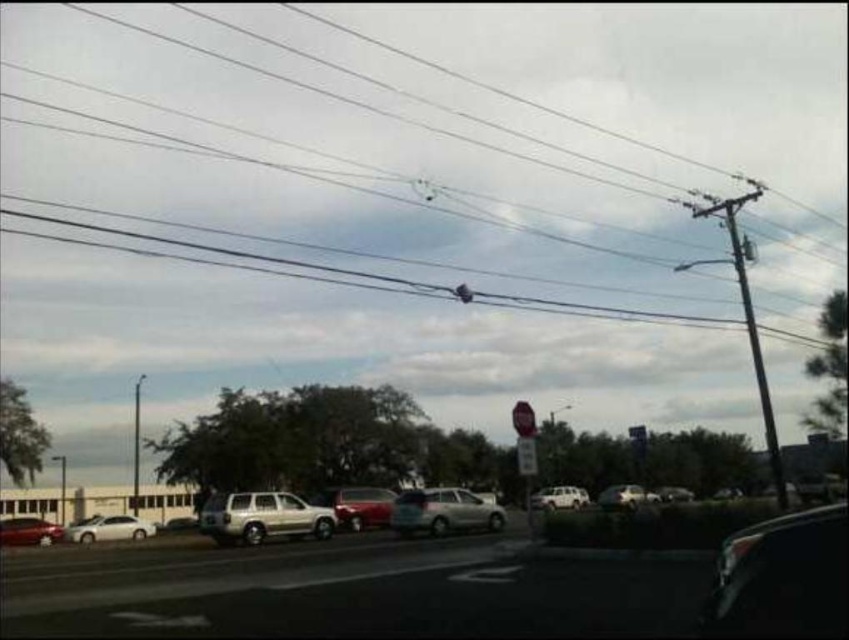
Question: Among these points, which one is farthest from the camera?

Choices:
 (A) click(8, 172)
 (B) click(633, 500)
 (C) click(94, 531)

Answer: (A)

Question: Is silver metallic sedan at center above white plastic sign at center?

Choices:
 (A) yes
 (B) no

Answer: (B)

Question: Considering the relative positions of silver metallic sedan at center and shiny silver sedan at lower right in the image provided, where is silver metallic sedan at center located with respect to shiny silver sedan at lower right?

Choices:
 (A) right
 (B) left

Answer: (B)

Question: Which point appears farthest from the camera in this image?

Choices:
 (A) (267, 502)
 (B) (133, 522)
 (C) (790, 544)
 (D) (609, 497)

Answer: (D)

Question: Is satin silver sedan at center in front of satin white sedan at lower left?

Choices:
 (A) no
 (B) yes

Answer: (B)

Question: Which of the following is the farthest from the observer?

Choices:
 (A) satin silver sedan at center
 (B) shiny red sedan at lower left

Answer: (B)